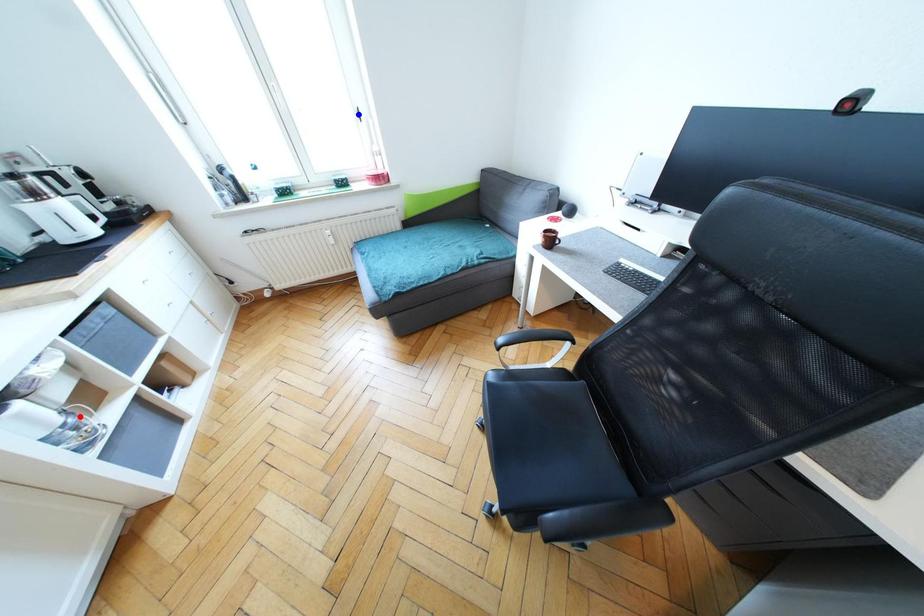
Question: In the image, two points are highlighted. Which point is nearer to the camera? Reply with the corresponding letter.

Choices:
 (A) blue point
 (B) red point

Answer: (B)